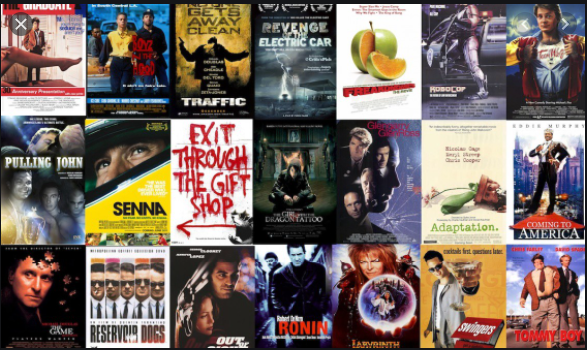
Where is `total number of movies posters on the bottom row`? This screenshot has height=350, width=587. total number of movies posters on the bottom row is located at coordinates (539, 305), (463, 295), (389, 310), (296, 303), (224, 298), (131, 306), (53, 295).